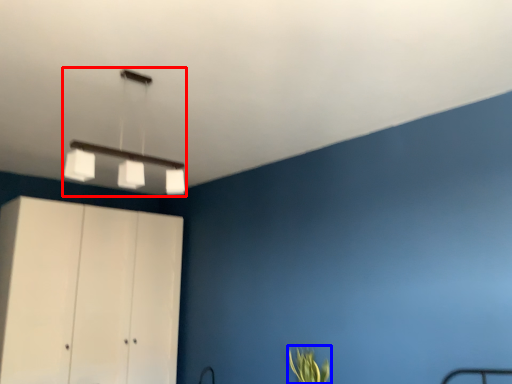
Question: Which object appears farthest to the camera in this image, lamp (highlighted by a red box) or plant (highlighted by a blue box)?

Choices:
 (A) lamp
 (B) plant

Answer: (B)